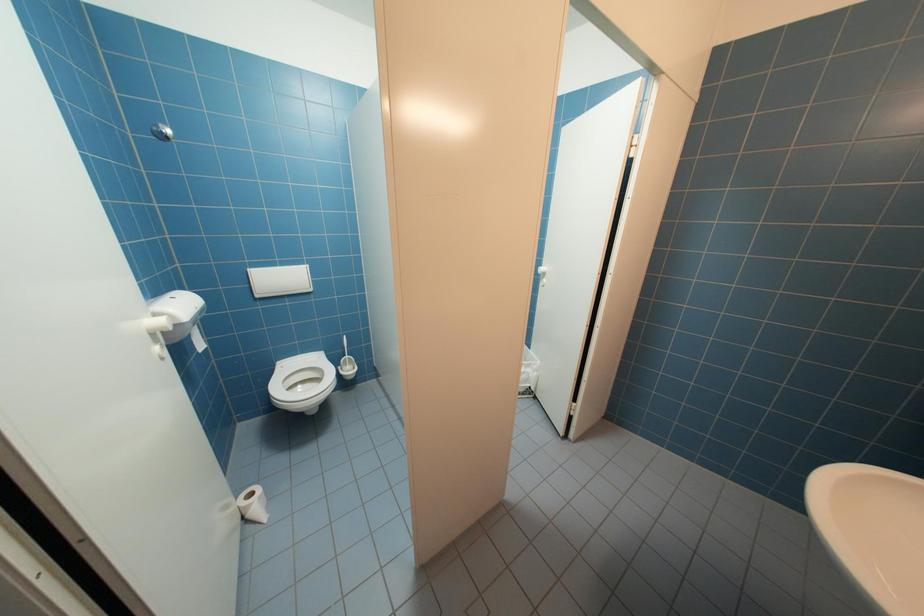
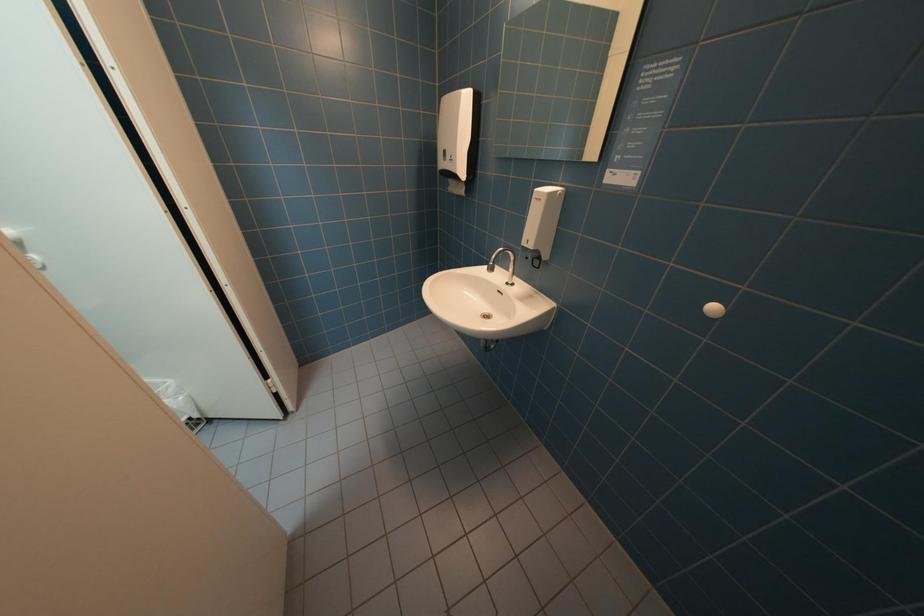
The first image is from the beginning of the video and the second image is from the end. How did the camera likely rotate when shooting the video?

The rotation direction of the camera is right-down.